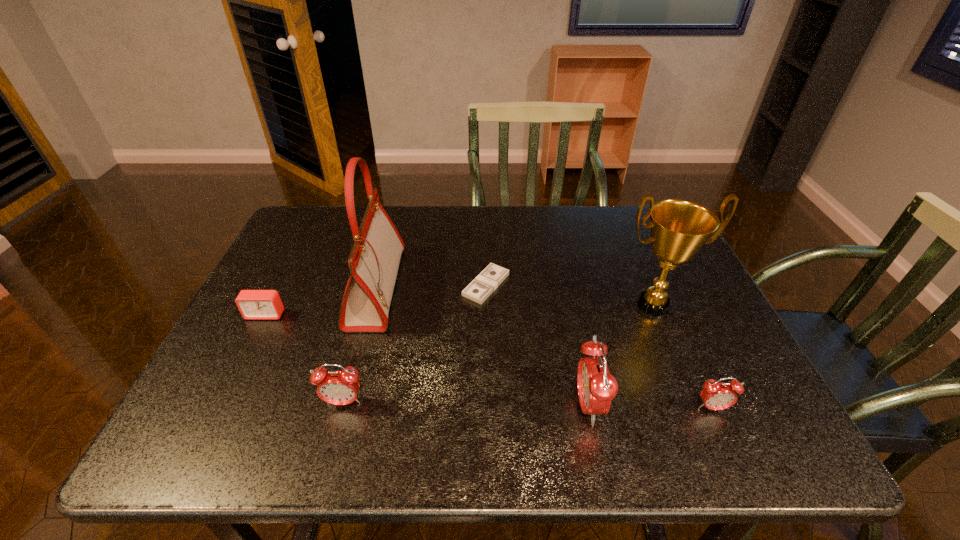
What are the coordinates of `handbag` in the screenshot? It's located at (374, 260).

At what (x,y) coordinates should I click in order to perform the action: click on award. Please return your answer as a coordinate pair (x, y). The width and height of the screenshot is (960, 540). Looking at the image, I should click on (679, 228).

Find the location of a particular element. vacant space located on the face of the third alarm clock from left to right is located at coordinates (409, 406).

This screenshot has height=540, width=960. Find the location of `vacant area situated on the face of the third alarm clock from left to right`. vacant area situated on the face of the third alarm clock from left to right is located at coordinates (492, 406).

Where is `vacant space located on the face of the third alarm clock from left to right`? This screenshot has height=540, width=960. vacant space located on the face of the third alarm clock from left to right is located at coordinates pos(448,406).

This screenshot has width=960, height=540. In order to click on free location located 0.190m on the right of the fourth object from right to left in this screenshot , I will do `click(582, 285)`.

In order to click on vacant space situated 0.200m on the front-facing side of the leftmost object in this screenshot , I will do `click(227, 390)`.

This screenshot has width=960, height=540. Identify the location of free space located 0.370m on the right of the handbag. (538, 288).

This screenshot has height=540, width=960. Find the location of `vacant space located 0.180m on the front view with handles of the award`. vacant space located 0.180m on the front view with handles of the award is located at coordinates (688, 388).

At what (x,y) coordinates should I click in order to perform the action: click on object located at the left edge. Please return your answer as a coordinate pair (x, y). The image size is (960, 540). Looking at the image, I should click on (253, 304).